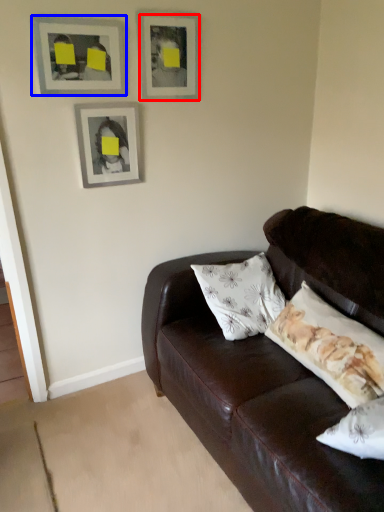
Question: Among these objects, which one is nearest to the camera, picture frame (highlighted by a red box) or picture frame (highlighted by a blue box)?

Choices:
 (A) picture frame
 (B) picture frame

Answer: (B)